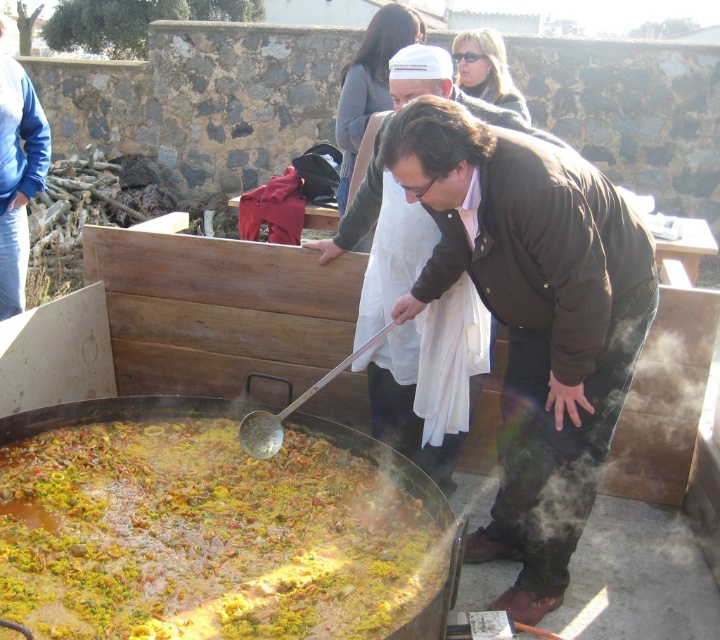
Question: Based on their relative distances, which object is farther from the blue cotton robe at left?

Choices:
 (A) brown leather jacket at center
 (B) yellow rice at center

Answer: (A)

Question: Which point is farther from the camera taking this photo?

Choices:
 (A) (374, 54)
 (B) (503, 458)

Answer: (A)

Question: Does blue cotton robe at left have a greater width compared to white cotton robe at upper center?

Choices:
 (A) no
 (B) yes

Answer: (B)

Question: From the image, what is the correct spatial relationship of brown cotton robe at center in relation to brown leather jacket at center?

Choices:
 (A) left
 (B) right

Answer: (B)

Question: Considering the real-world distances, which object is closest to the yellow rice at center?

Choices:
 (A) white cotton robe at upper center
 (B) blue cotton robe at left

Answer: (B)

Question: Can you confirm if brown cotton robe at center is positioned below brown leather jacket at center?

Choices:
 (A) yes
 (B) no

Answer: (A)